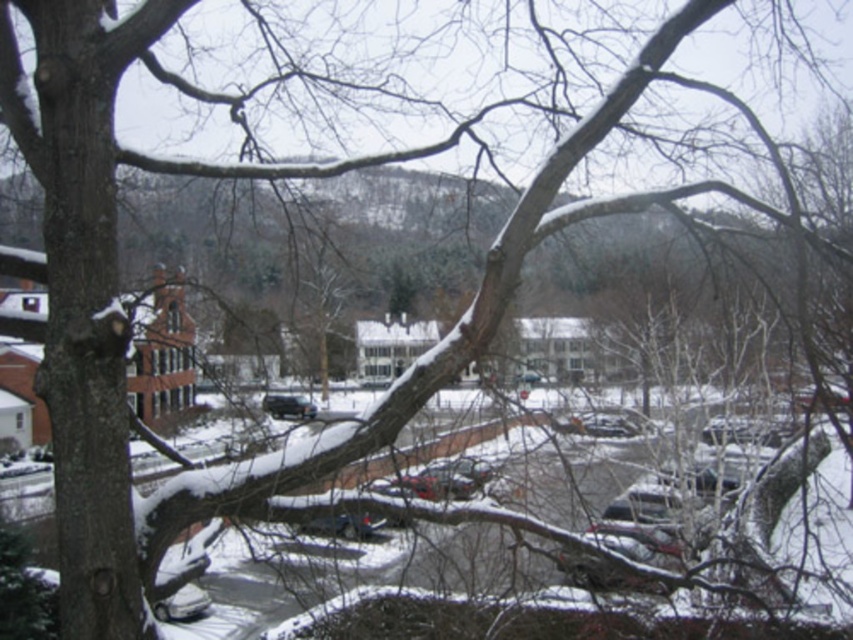
Question: Can you confirm if metallic silver car at lower left is bigger than satin black car at center?

Choices:
 (A) yes
 (B) no

Answer: (A)

Question: In this image, where is metallic silver car at lower left located relative to satin black car at center?

Choices:
 (A) left
 (B) right

Answer: (B)

Question: Among these points, which one is nearest to the camera?

Choices:
 (A) (165, 598)
 (B) (305, 401)

Answer: (A)

Question: Does metallic silver car at lower left have a lesser width compared to satin black car at center?

Choices:
 (A) yes
 (B) no

Answer: (B)

Question: Which point is closer to the camera taking this photo?

Choices:
 (A) (206, 593)
 (B) (277, 397)

Answer: (A)